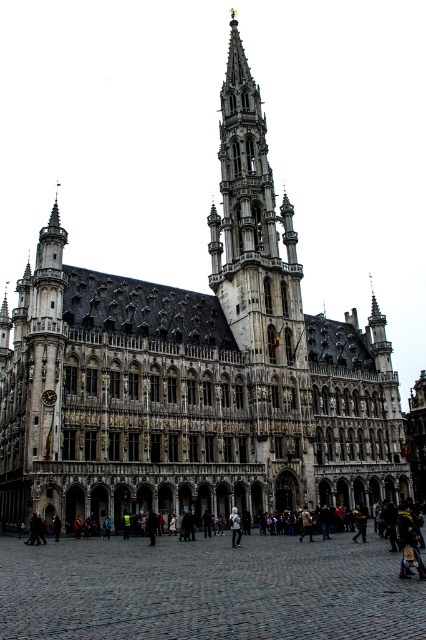
Consider the image. You are an architect assessing the building for accessibility improvements. You notice the brown cobblestone at center and the dark clothing at center. Which object is lower in height?

The brown cobblestone at center has a lesser height compared to dark clothing at center, so the brown cobblestone at center is lower in height.

You are standing in front of the historic building and want to place a small statue on the brown cobblestone at center so that it can be seen by the white fabric person at center. Will the statue be visible to them?

The brown cobblestone at center is taller than the white fabric person at center, so the statue placed on it will likely be visible since the cobblestone elevates it above the person.

You are a tour guide standing in front of the grand historic building. You notice both the brown cobblestone at center and the dark clothing at center. Which object takes up more space visually in the scene?

The dark clothing at center takes up more space visually in the scene because the brown cobblestone at center occupies less space than the dark clothing at center.